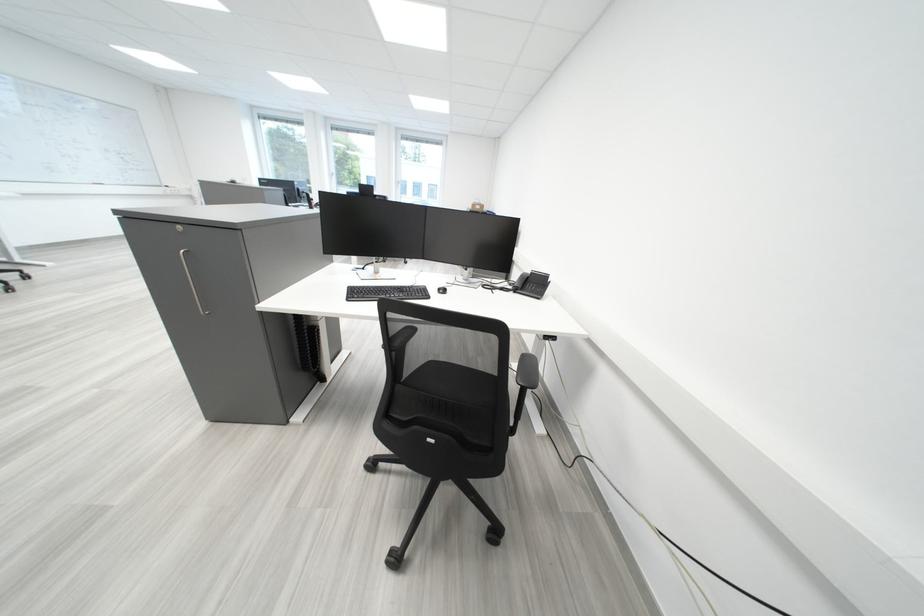
Where is `black telephone handset`? This screenshot has width=924, height=616. black telephone handset is located at coordinates (520, 280).